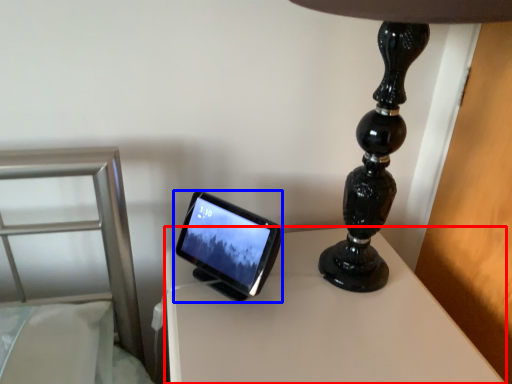
Question: Which of the following is the farthest to the observer, table (highlighted by a red box) or tablet computer (highlighted by a blue box)?

Choices:
 (A) table
 (B) tablet computer

Answer: (B)